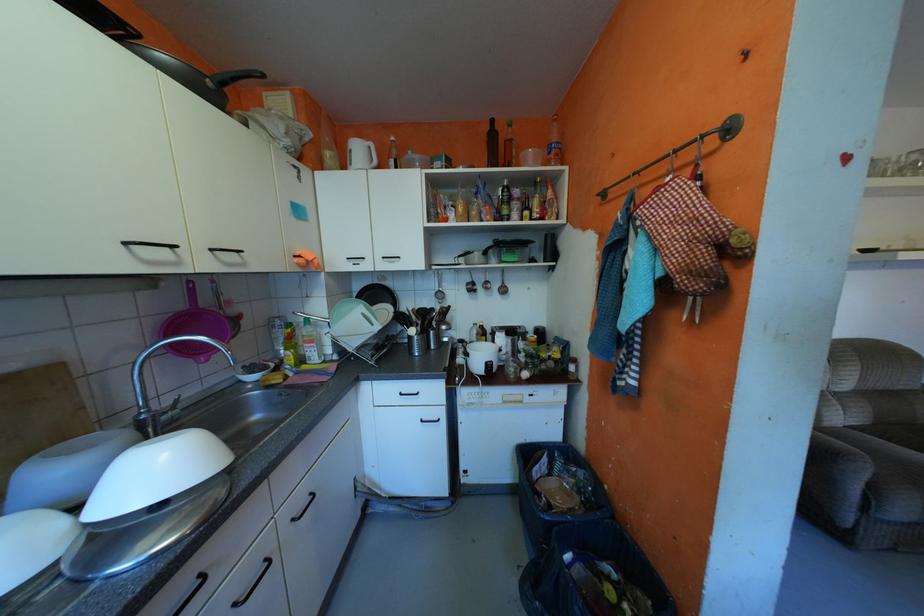
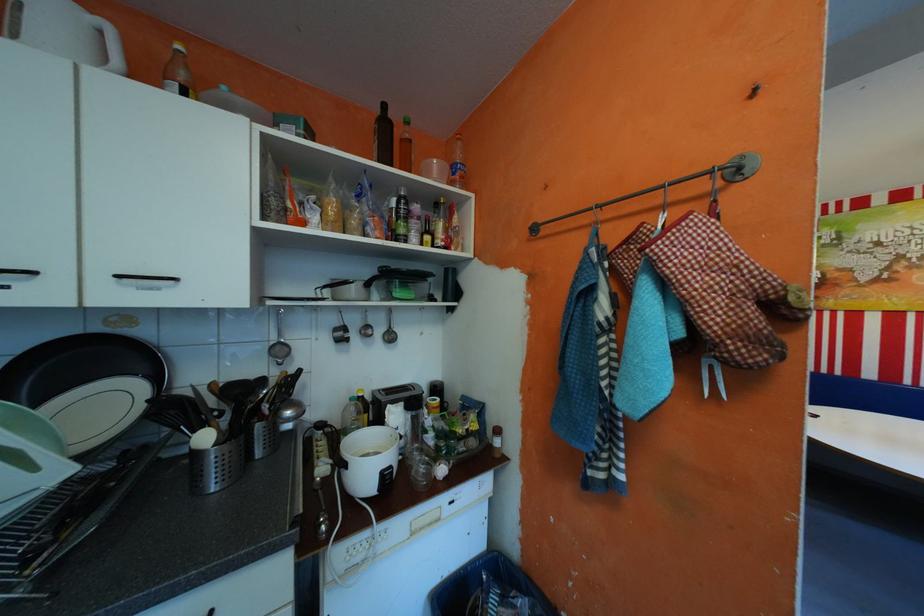
Find the pixel in the second image that matches point (493, 325) in the first image.

(372, 397)